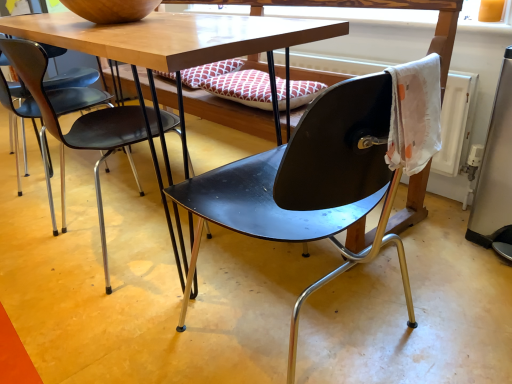
Find the location of a particular element. vacant space to the right of matte black chair at center, placed as the 2th chair when sorted from left to right is located at coordinates (438, 294).